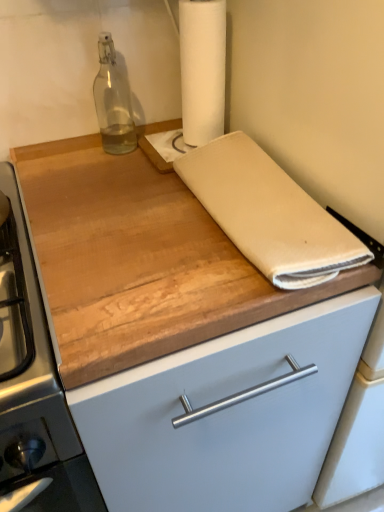
Find the location of `free spot in front of transparent glass bottle at upper left`. free spot in front of transparent glass bottle at upper left is located at coordinates (104, 177).